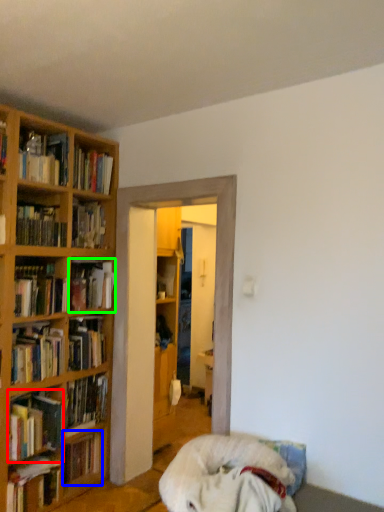
Question: Which is nearer to the book (highlighted by a red box)? book (highlighted by a blue box) or book (highlighted by a green box).

Choices:
 (A) book
 (B) book

Answer: (A)